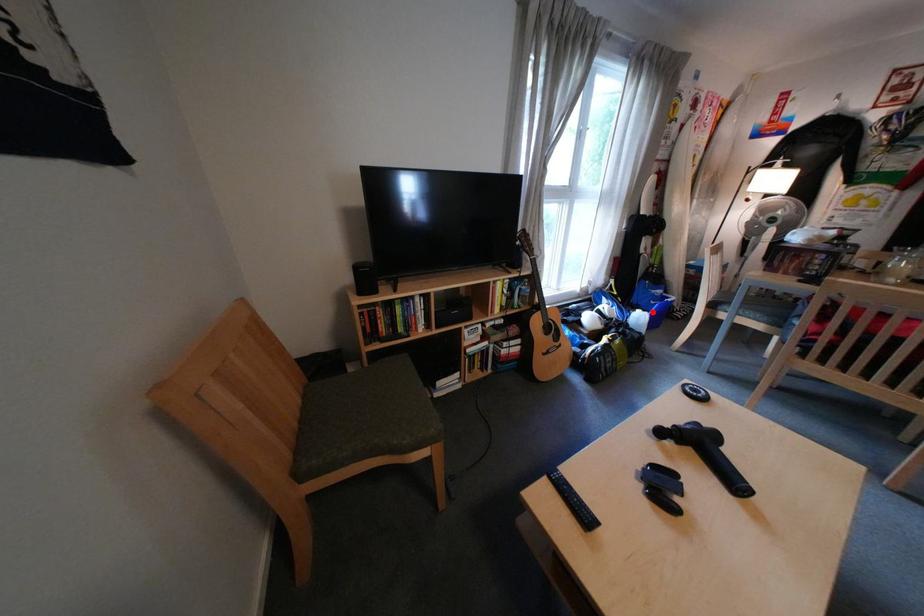
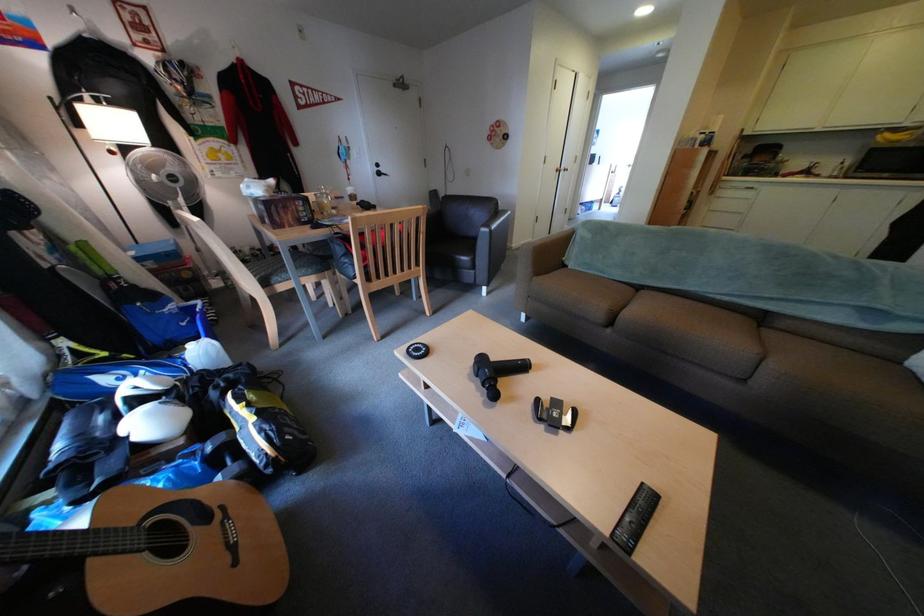
Find the pixel in the second image that matches the highlighted location in the first image.

(204, 347)